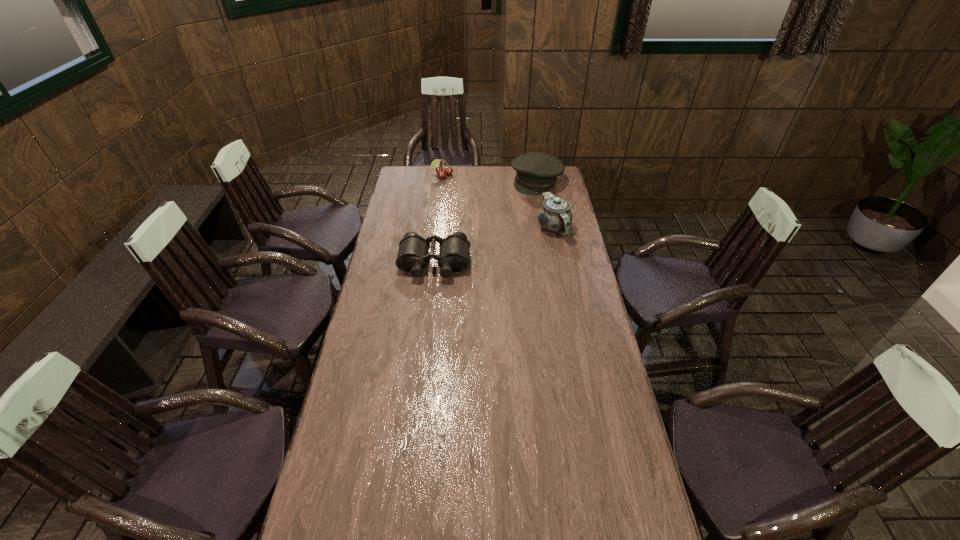
Find the location of a particular element. Image resolution: width=960 pixels, height=540 pixels. vacant region located 0.210m on the front-facing side of the beret is located at coordinates (509, 214).

At what (x,y) coordinates should I click in order to perform the action: click on vacant space located 0.180m on the front-facing side of the beret. Please return your answer as a coordinate pair (x, y). This screenshot has width=960, height=540. Looking at the image, I should click on (512, 211).

Locate an element on the screen. free point located 0.400m on the front-facing side of the beret is located at coordinates coord(492,234).

Where is `cherry situated at the far edge`? The height and width of the screenshot is (540, 960). cherry situated at the far edge is located at coordinates (441, 172).

Identify the location of beret at the far edge. (537, 173).

Find the location of `object that is at the left edge`. object that is at the left edge is located at coordinates (412, 256).

At what (x,y) coordinates should I click in order to perform the action: click on chinaware located in the right edge section of the desktop. Please return your answer as a coordinate pair (x, y). This screenshot has width=960, height=540. Looking at the image, I should click on (555, 215).

Locate an element on the screen. beret located in the right edge section of the desktop is located at coordinates (537, 173).

This screenshot has height=540, width=960. What are the coordinates of `object that is at the far right corner` in the screenshot? It's located at (537, 173).

Identify the location of free space at the near edge of the desktop. (533, 524).